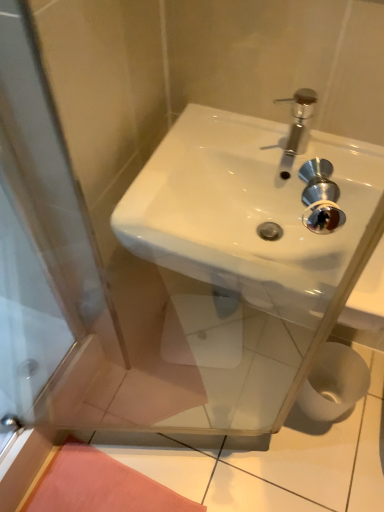
What is the approximate width of white glossy sink at center?

The width of white glossy sink at center is 47.81 centimeters.

Describe the element at coordinates (250, 210) in the screenshot. The image size is (384, 512). I see `white glossy sink at center` at that location.

The width and height of the screenshot is (384, 512). I want to click on white glossy sink at center, so click(x=250, y=210).

The width and height of the screenshot is (384, 512). In order to click on white matte toilet paper at lower right in this screenshot , I will do `click(334, 383)`.

What do you see at coordinates (334, 383) in the screenshot? The image size is (384, 512). I see `white matte toilet paper at lower right` at bounding box center [334, 383].

Locate an element on the screen. The height and width of the screenshot is (512, 384). white glossy sink at center is located at coordinates (250, 210).

Does white matte toilet paper at lower right appear on the left side of white glossy sink at center?

No.

Is white matte toilet paper at lower right in front of or behind white glossy sink at center in the image?

Visually, white matte toilet paper at lower right is located behind white glossy sink at center.

Is point (340, 346) in front of point (158, 176)?

No, (340, 346) is behind (158, 176).

From the picture: From the image's perspective, which one is positioned higher, white matte toilet paper at lower right or white glossy sink at center?

From the image's view, white glossy sink at center is above.

From a real-world perspective, does white matte toilet paper at lower right stand above white glossy sink at center?

No.

Which of these two, white matte toilet paper at lower right or white glossy sink at center, is wider?

Wider between the two is white glossy sink at center.

Does white matte toilet paper at lower right have a lesser height compared to white glossy sink at center?

No, white matte toilet paper at lower right is not shorter than white glossy sink at center.

Which of these two, white matte toilet paper at lower right or white glossy sink at center, is smaller?

Smaller between the two is white matte toilet paper at lower right.

Is white glossy sink at center surrounded by white matte toilet paper at lower right?

That's incorrect, white glossy sink at center is not inside white matte toilet paper at lower right.

Is white matte toilet paper at lower right beside white glossy sink at center?

No, white matte toilet paper at lower right is not beside white glossy sink at center.

Does white matte toilet paper at lower right turn towards white glossy sink at center?

No, white matte toilet paper at lower right is not aimed at white glossy sink at center.

Measure the distance between white matte toilet paper at lower right and white glossy sink at center.

The distance of white matte toilet paper at lower right from white glossy sink at center is 25.58 inches.

Where is `toilet paper that is below the white glossy sink at center (from the image's perspective)`? This screenshot has height=512, width=384. toilet paper that is below the white glossy sink at center (from the image's perspective) is located at coordinates (334, 383).

Does white glossy sink at center appear on the left side of white matte toilet paper at lower right?

Correct, you'll find white glossy sink at center to the left of white matte toilet paper at lower right.

Which object is further away from the camera taking this photo, white glossy sink at center or white matte toilet paper at lower right?

white matte toilet paper at lower right is further from the camera.

Does point (239, 239) come farther from viewer compared to point (344, 397)?

That is False.

From the image's perspective, which object appears higher, white glossy sink at center or white matte toilet paper at lower right?

From the image's view, white glossy sink at center is above.

From the picture: From a real-world perspective, between white glossy sink at center and white matte toilet paper at lower right, who is vertically higher?

white glossy sink at center.

Can you confirm if white glossy sink at center is thinner than white matte toilet paper at lower right?

No, white glossy sink at center is not thinner than white matte toilet paper at lower right.

Can you confirm if white glossy sink at center is taller than white matte toilet paper at lower right?

No, white glossy sink at center is not taller than white matte toilet paper at lower right.

Considering the sizes of objects white glossy sink at center and white matte toilet paper at lower right in the image provided, who is bigger, white glossy sink at center or white matte toilet paper at lower right?

Bigger between the two is white glossy sink at center.

Is white glossy sink at center positioned beyond the bounds of white matte toilet paper at lower right?

That's correct, white glossy sink at center is outside of white matte toilet paper at lower right.

Is white glossy sink at center not near white matte toilet paper at lower right?

That's not correct — white glossy sink at center is a little close to white matte toilet paper at lower right.

Based on the photo, does white glossy sink at center turn towards white matte toilet paper at lower right?

No, white glossy sink at center is not aimed at white matte toilet paper at lower right.

How different are the orientations of white glossy sink at center and white matte toilet paper at lower right in degrees?

There is a 0.53-degree angle between the facing directions of white glossy sink at center and white matte toilet paper at lower right.

Image resolution: width=384 pixels, height=512 pixels. I want to click on sink in front of the white matte toilet paper at lower right, so click(250, 210).

Where is `sink in front of the white matte toilet paper at lower right`? Image resolution: width=384 pixels, height=512 pixels. sink in front of the white matte toilet paper at lower right is located at coordinates (250, 210).

Locate an element on the screen. The width and height of the screenshot is (384, 512). sink on the left of white matte toilet paper at lower right is located at coordinates (250, 210).